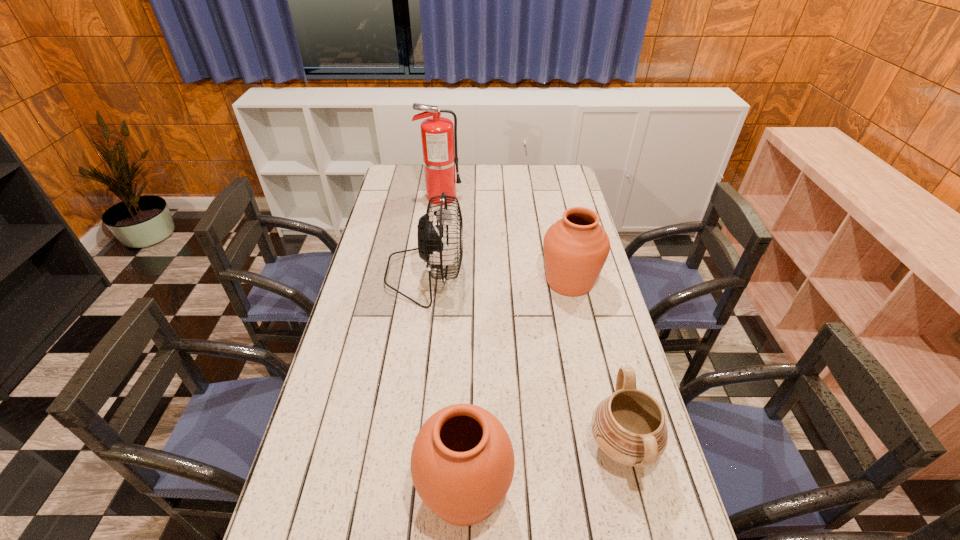
I want to click on vacant space that satisfies the following two spatial constraints: 1. at the nozzle of the farthest object; 2. on the right side of the farthest urn, so click(431, 281).